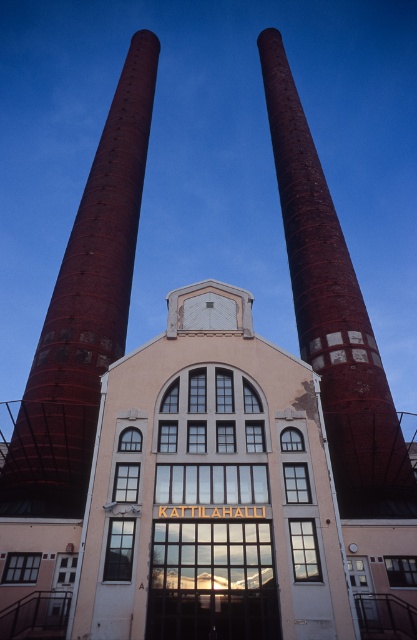
Question: Does rusty brick chimney at center-left have a lesser width compared to rusty brick chimney at center?

Choices:
 (A) no
 (B) yes

Answer: (A)

Question: Can you confirm if rusty brick chimney at center-left is wider than rusty brick chimney at center?

Choices:
 (A) no
 (B) yes

Answer: (B)

Question: Which object appears closest to the camera in this image?

Choices:
 (A) rusty brick chimney at center
 (B) rusty brick chimney at center-left

Answer: (B)

Question: From the image, what is the correct spatial relationship of rusty brick chimney at center-left in relation to rusty brick chimney at center?

Choices:
 (A) right
 (B) left

Answer: (B)

Question: Which of the following is the farthest from the observer?

Choices:
 (A) rusty brick chimney at center
 (B) rusty brick chimney at center-left

Answer: (A)